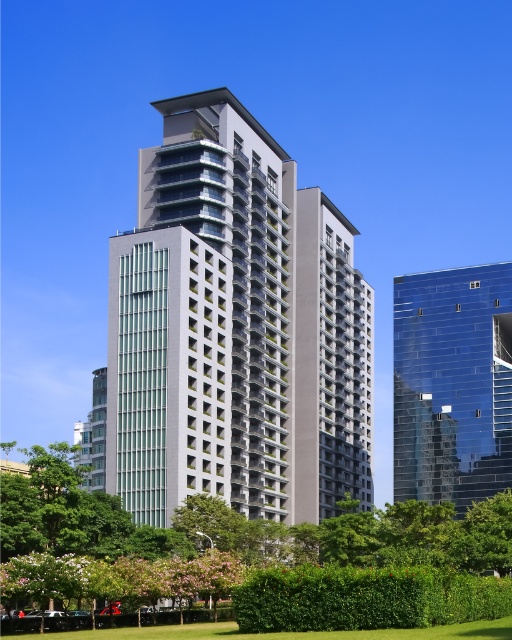
Which is above, green leafy park at center or green grass at lower center?

green grass at lower center is above.

Is green leafy park at center to the right of green grass at lower center from the viewer's perspective?

Indeed, green leafy park at center is positioned on the right side of green grass at lower center.

The width and height of the screenshot is (512, 640). What do you see at coordinates (294, 570) in the screenshot? I see `green leafy park at center` at bounding box center [294, 570].

The height and width of the screenshot is (640, 512). What are the coordinates of `green leafy park at center` in the screenshot? It's located at (294, 570).

Between white glass building at center and green grass at lower center, which one is positioned lower?

green grass at lower center is below.

What do you see at coordinates (234, 330) in the screenshot?
I see `white glass building at center` at bounding box center [234, 330].

Find the location of a particular element. white glass building at center is located at coordinates (234, 330).

Which is behind, point (400, 292) or point (212, 637)?

Positioned behind is point (400, 292).

Who is more distant from viewer, (484, 336) or (246, 636)?

Point (484, 336)

This screenshot has width=512, height=640. In order to click on transparent glass building at right in this screenshot , I will do `click(453, 385)`.